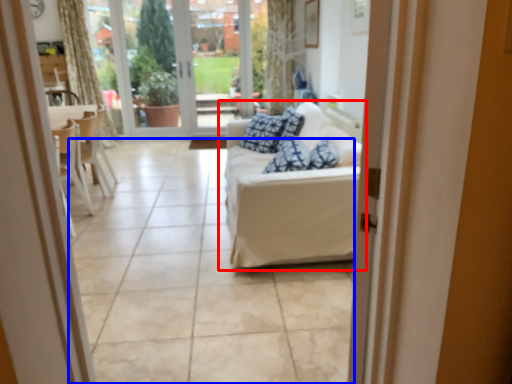
Question: Among these objects, which one is farthest to the camera, studio couch (highlighted by a red box) or tile (highlighted by a blue box)?

Choices:
 (A) studio couch
 (B) tile

Answer: (A)